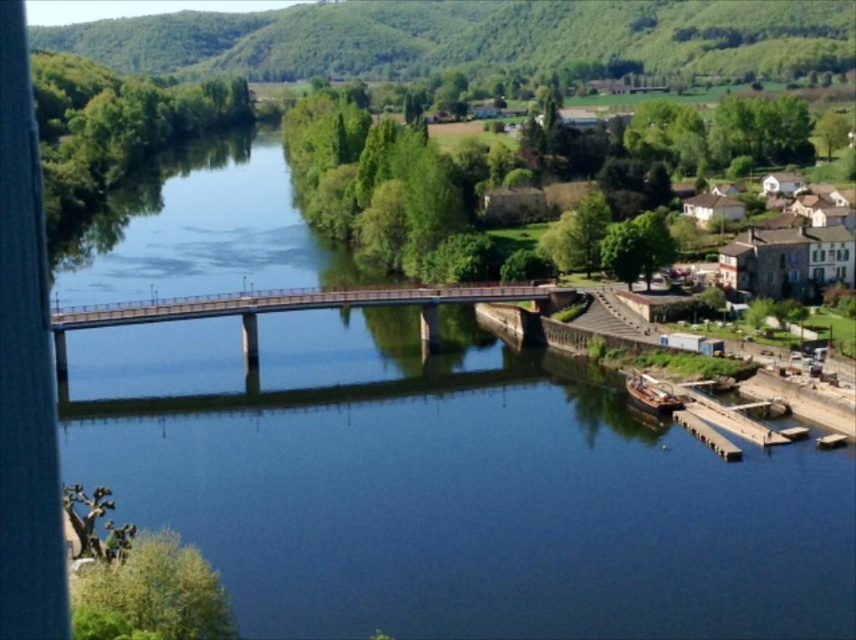
Question: Is smooth concrete bridge at center smaller than white stone houses at upper right?

Choices:
 (A) no
 (B) yes

Answer: (B)

Question: Is smooth concrete bridge at center above white stone houses at upper right?

Choices:
 (A) yes
 (B) no

Answer: (B)

Question: Which point is farther to the camera?

Choices:
 (A) smooth concrete bridge at center
 (B) white stone houses at upper right

Answer: (B)

Question: Can you confirm if smooth concrete bridge at center is positioned below white stone houses at upper right?

Choices:
 (A) yes
 (B) no

Answer: (A)

Question: Which point appears closest to the camera in this image?

Choices:
 (A) (373, 300)
 (B) (712, 195)

Answer: (A)

Question: Which object is closer to the camera taking this photo?

Choices:
 (A) smooth concrete bridge at center
 (B) white stone houses at upper right

Answer: (A)